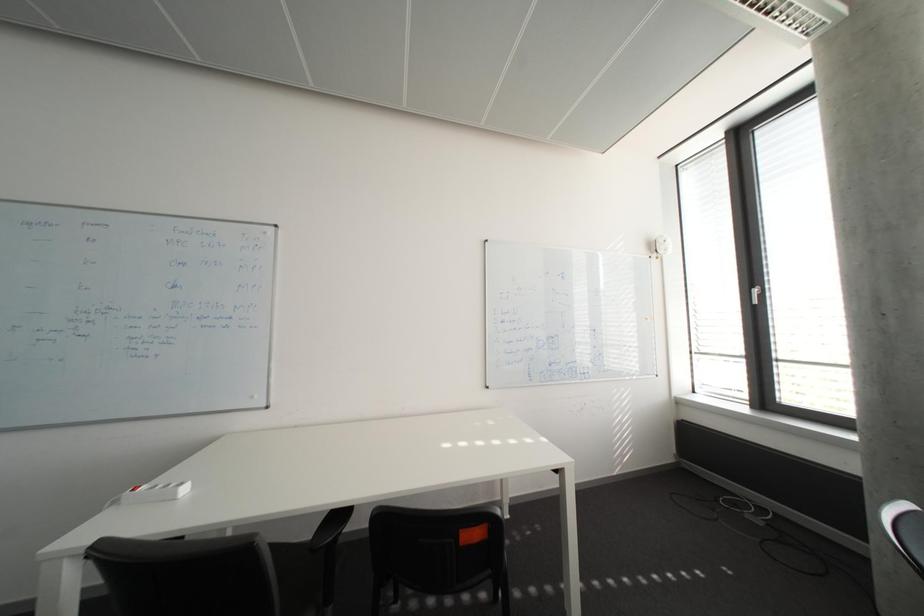
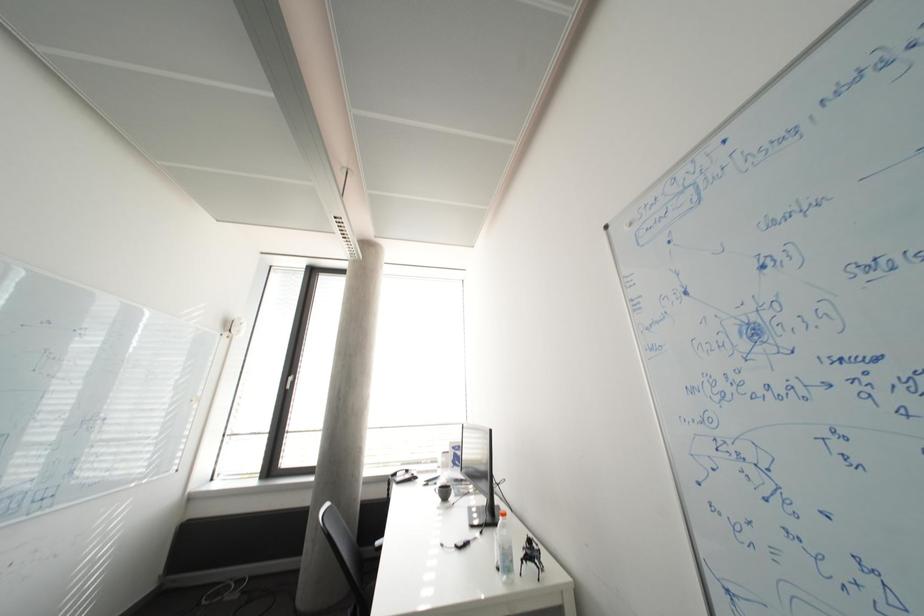
Based on the continuous images, in which direction is the camera rotating?

The camera's rotation is toward right-up.